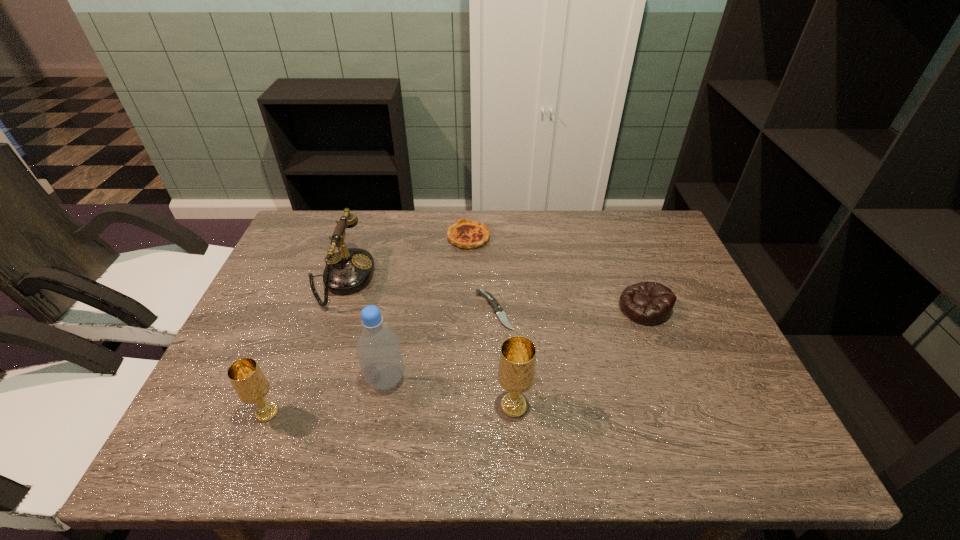
Where is `telephone located at the left edge`? This screenshot has width=960, height=540. telephone located at the left edge is located at coordinates (349, 270).

You are a GUI agent. You are given a task and a screenshot of the screen. Output one action in this format:
    pyautogui.click(x=<x>, y=<y>)
    Task: Click on the object that is at the right edge
    
    Given the screenshot: What is the action you would take?
    pyautogui.click(x=648, y=303)

Where is `object that is at the far left corner`? Image resolution: width=960 pixels, height=540 pixels. object that is at the far left corner is located at coordinates (349, 270).

The height and width of the screenshot is (540, 960). I want to click on object positioned at the near left corner, so click(249, 382).

Where is `vacant space at the far edge of the desktop`? vacant space at the far edge of the desktop is located at coordinates (521, 220).

Where is `blank space at the near edge of the desktop`? The image size is (960, 540). blank space at the near edge of the desktop is located at coordinates pyautogui.click(x=587, y=416).

This screenshot has width=960, height=540. Find the location of `vacant space at the left edge of the desktop`. vacant space at the left edge of the desktop is located at coordinates (321, 264).

Locate an element on the screen. Image resolution: width=960 pixels, height=540 pixels. vacant space at the right edge is located at coordinates (641, 269).

You are a GUI agent. You are given a task and a screenshot of the screen. Output one action in this format:
    pyautogui.click(x=<x>, y=<y>)
    Task: Click on the free space at the far left corner of the desktop
    
    Given the screenshot: What is the action you would take?
    pyautogui.click(x=301, y=230)

I want to click on free space between the third object from left to right and the left chalice, so click(326, 396).